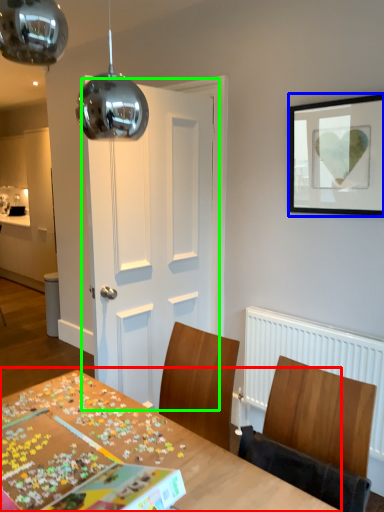
Question: Which object is positioned farthest from table (highlighted by a red box)? Select from picture frame (highlighted by a blue box) and door (highlighted by a green box).

Choices:
 (A) picture frame
 (B) door

Answer: (A)